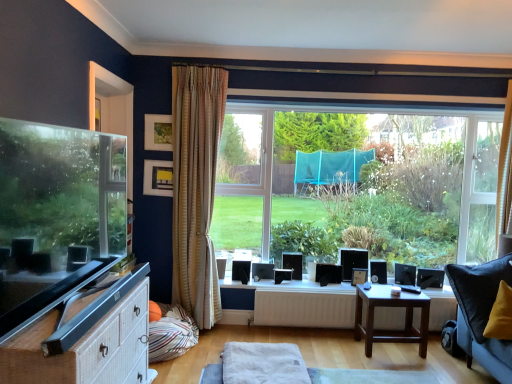
You are a GUI agent. You are given a task and a screenshot of the screen. Output one action in this format:
    pyautogui.click(x=<x>, y=<y>)
    Task: Click on the vacant space positioned to the left of brown wooden table at lower right
    The width and height of the screenshot is (512, 384).
    Given the screenshot: What is the action you would take?
    pyautogui.click(x=336, y=347)